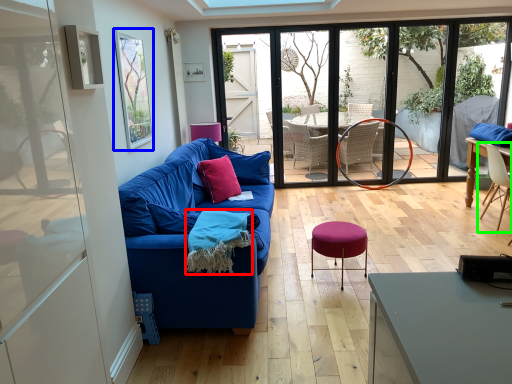
Question: Which object is the closest to the material (highlighted by a red box)? Choose among these: window screen (highlighted by a blue box) or chair (highlighted by a green box).

Choices:
 (A) window screen
 (B) chair

Answer: (A)